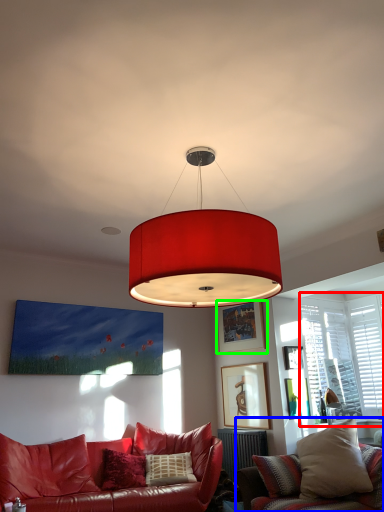
Question: Considering the real-world distances, which object is farthest from window (highlighted by a red box)? studio couch (highlighted by a blue box) or picture frame (highlighted by a green box)?

Choices:
 (A) studio couch
 (B) picture frame

Answer: (A)